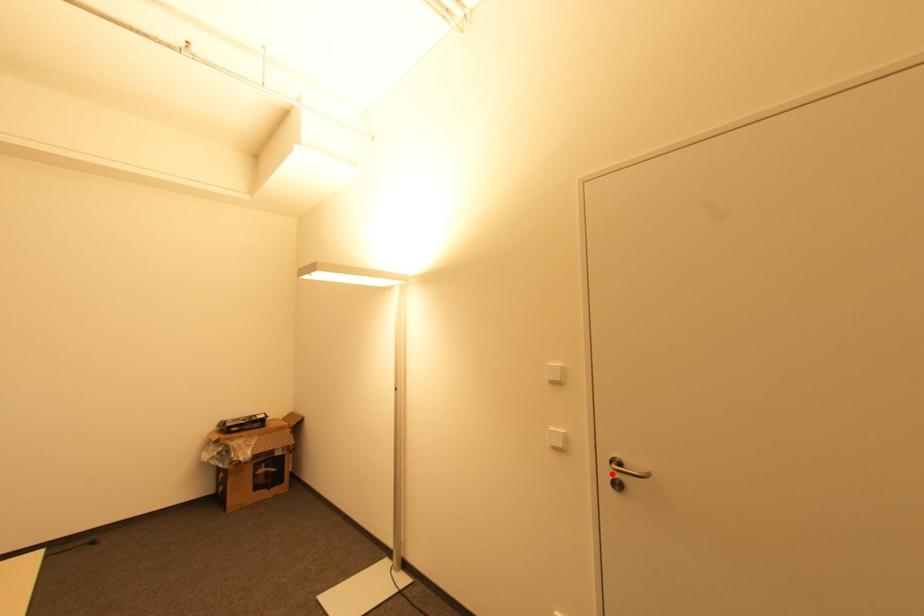
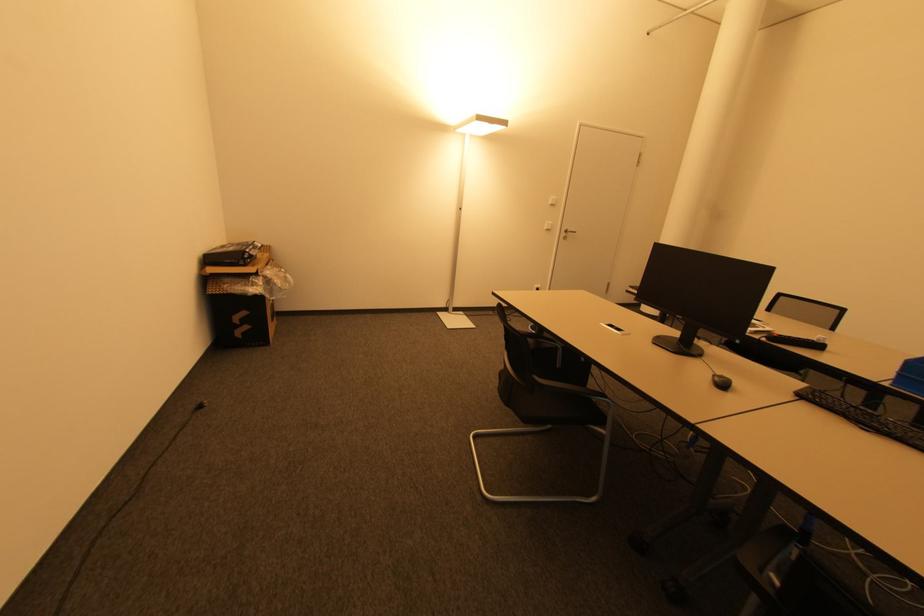
Question: I am providing you with two images of the same scene from different viewpoints. Image1 has a red point marked. In image2, the corresponding 3D location appears at what relative position? Reply with the corresponding letter.

Choices:
 (A) Closer
 (B) Farther

Answer: (A)